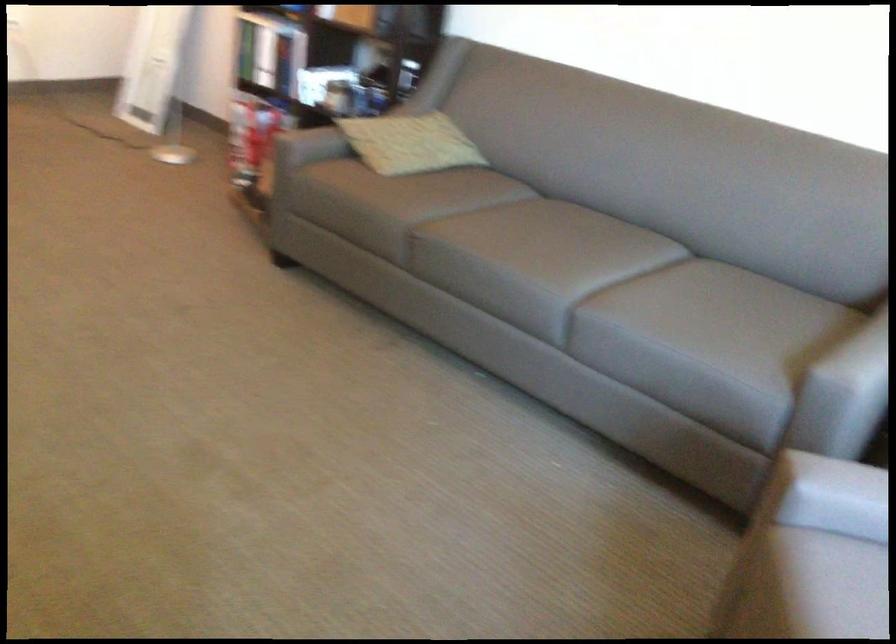
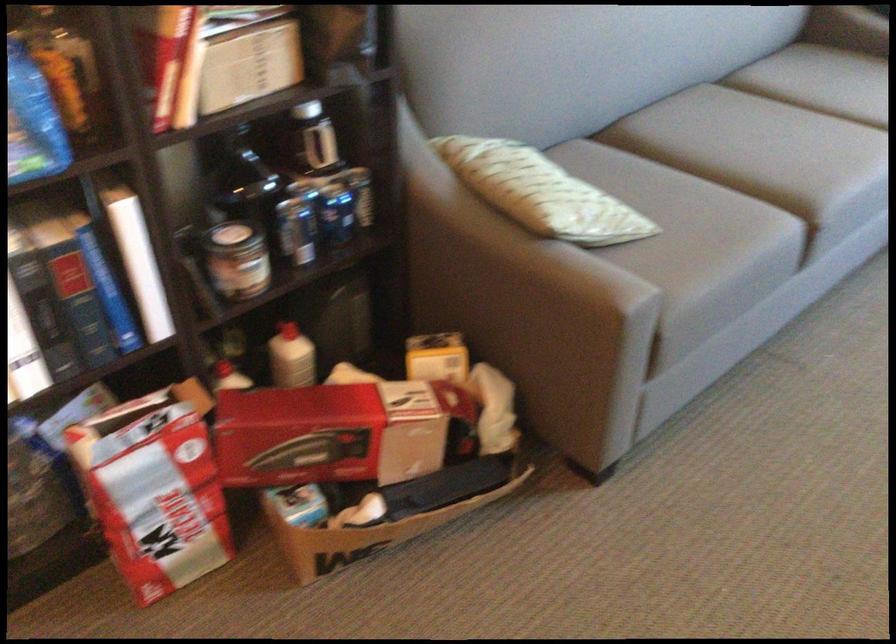
Locate, in the second image, the point that corresponds to [231,129] in the first image.

(297, 433)